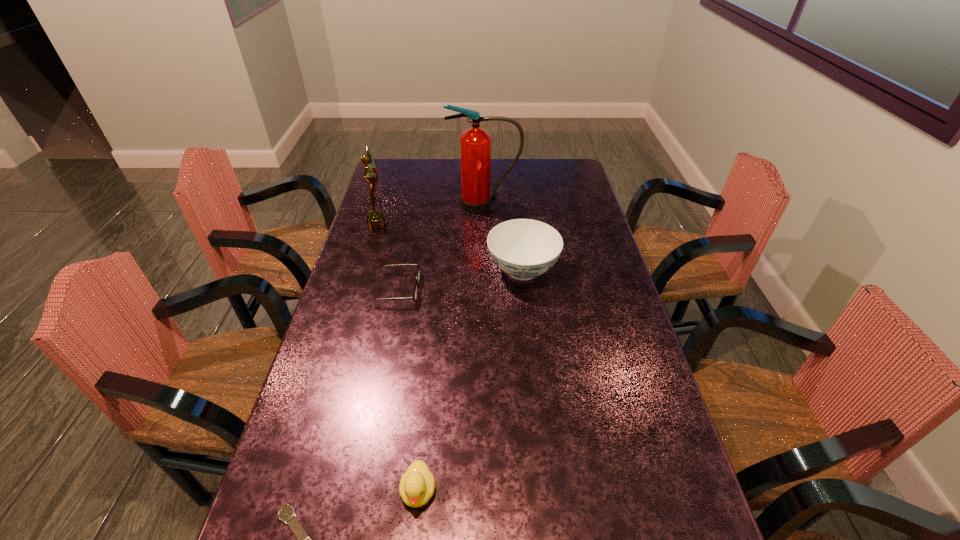
This screenshot has width=960, height=540. In order to click on the tallest object in this screenshot , I will do `click(475, 144)`.

This screenshot has width=960, height=540. In order to click on the farthest object in this screenshot , I will do `click(475, 144)`.

I want to click on award, so point(375,220).

The width and height of the screenshot is (960, 540). Identify the location of the fifth nearest object. (375, 220).

Identify the location of chinaware. (523, 248).

This screenshot has height=540, width=960. Find the location of `the third shortest object`. the third shortest object is located at coordinates (417, 485).

Image resolution: width=960 pixels, height=540 pixels. I want to click on the fifth tallest object, so click(414, 297).

Where is `the third object from left to right`? This screenshot has width=960, height=540. the third object from left to right is located at coordinates pos(414,297).

The image size is (960, 540). Identify the location of vacant point located on the left of the fire extinguisher. (398, 205).

Find the location of a particular element. This screenshot has width=960, height=540. free location located 0.070m on the front-facing side of the second tallest object is located at coordinates (405, 225).